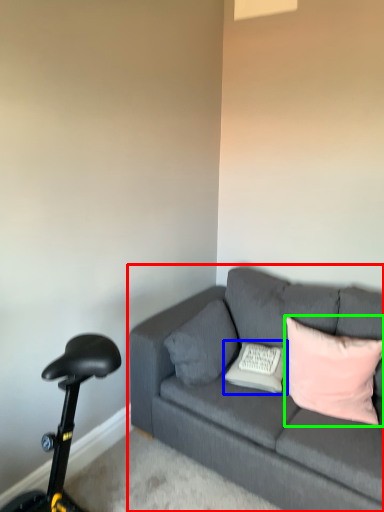
Question: Which is farther away from studio couch (highlighted by a red box)? pillow (highlighted by a blue box) or pillow (highlighted by a green box)?

Choices:
 (A) pillow
 (B) pillow

Answer: (A)